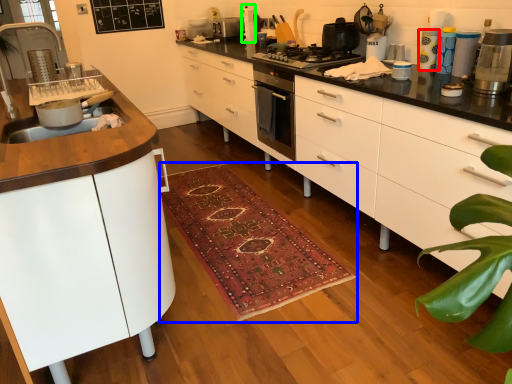
Question: Based on their relative distances, which object is farther from appliance (highlighted by a red box)? Choose from doormat (highlighted by a blue box) and appliance (highlighted by a green box).

Choices:
 (A) doormat
 (B) appliance

Answer: (B)